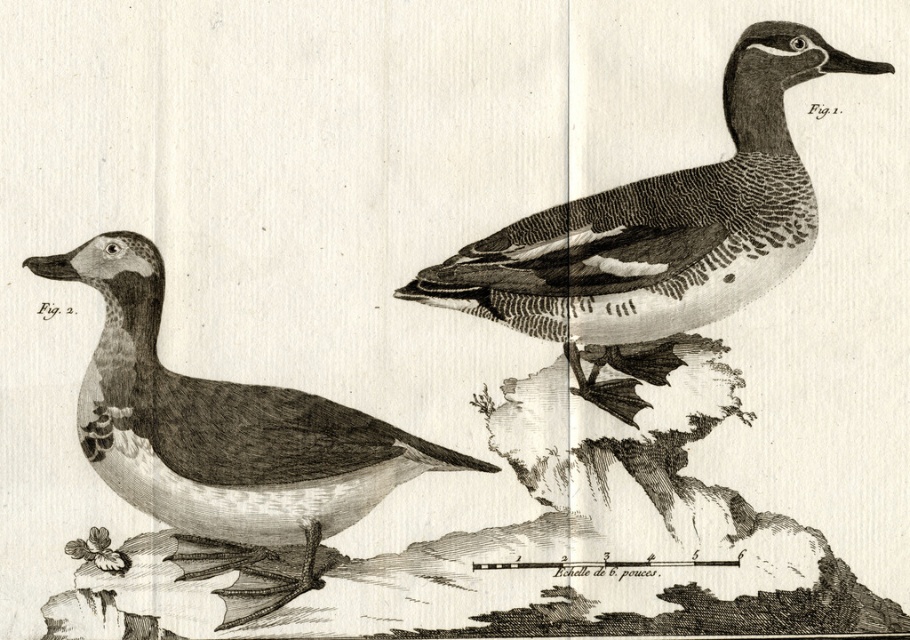
Can you confirm if etched wood duck at upper right is bigger than smooth black duck at left?

Correct, etched wood duck at upper right is larger in size than smooth black duck at left.

Who is higher up, etched wood duck at upper right or smooth black duck at left?

Positioned higher is etched wood duck at upper right.

This screenshot has width=910, height=640. What do you see at coordinates (658, 236) in the screenshot?
I see `etched wood duck at upper right` at bounding box center [658, 236].

You are a GUI agent. You are given a task and a screenshot of the screen. Output one action in this format:
    pyautogui.click(x=<x>, y=<y>)
    Task: Click on the etched wood duck at upper right
    The image size is (910, 640).
    Given the screenshot: What is the action you would take?
    pyautogui.click(x=658, y=236)